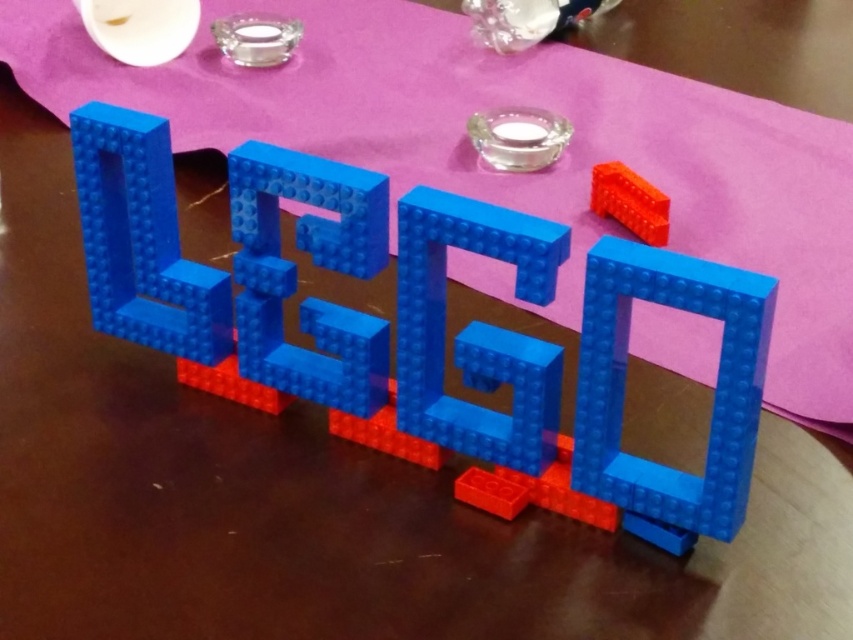
Consider the image. You are positioning a new LEGO brick and need to place it precisely. Where exactly is the blue plastic letter g at center located in terms of coordinates?

The blue plastic letter g at center is located at point coordinates of (474, 330).

You are organizing a LEGO display and need to place a new rubber brick. According to the image, where should the rubber brick at upper right be positioned relative to the blue plastic letter g at center?

The rubber brick at upper right should be placed above the blue plastic letter g at center, as the blue plastic letter g at center is located below the rubber brick at upper right.